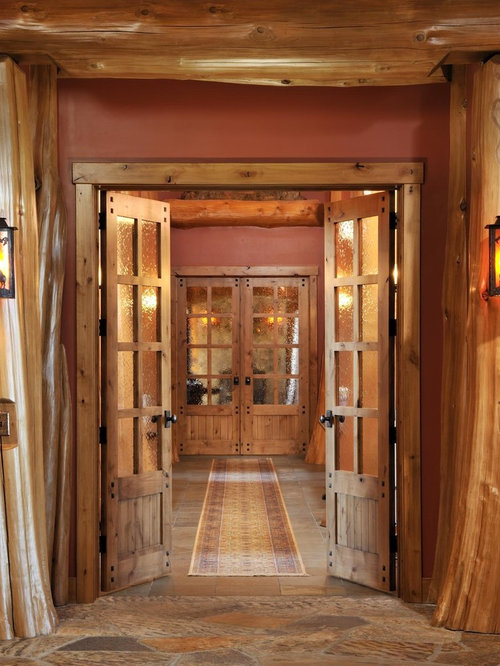
This screenshot has width=500, height=666. Find the location of `door jamb`. door jamb is located at coordinates (252, 270), (264, 176).